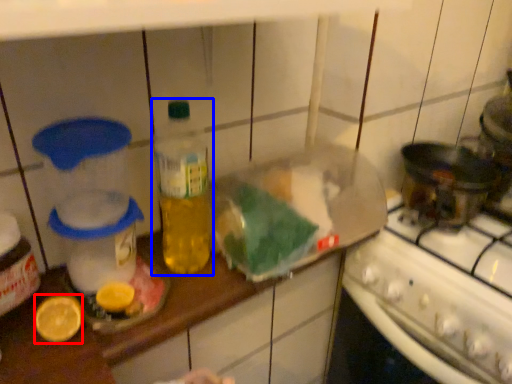
Question: Among these objects, which one is farthest to the camera, lemon (highlighted by a red box) or bottle (highlighted by a blue box)?

Choices:
 (A) lemon
 (B) bottle

Answer: (B)